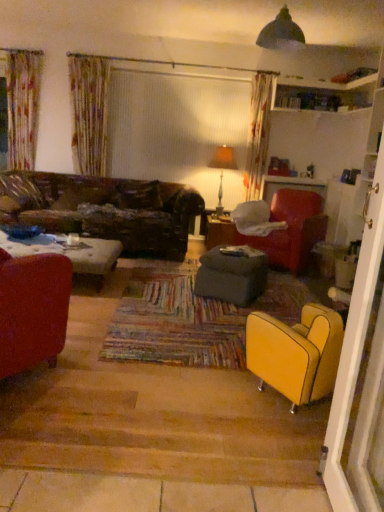
This screenshot has height=512, width=384. I want to click on free point in front of dark gray fabric ottoman at center, so click(219, 311).